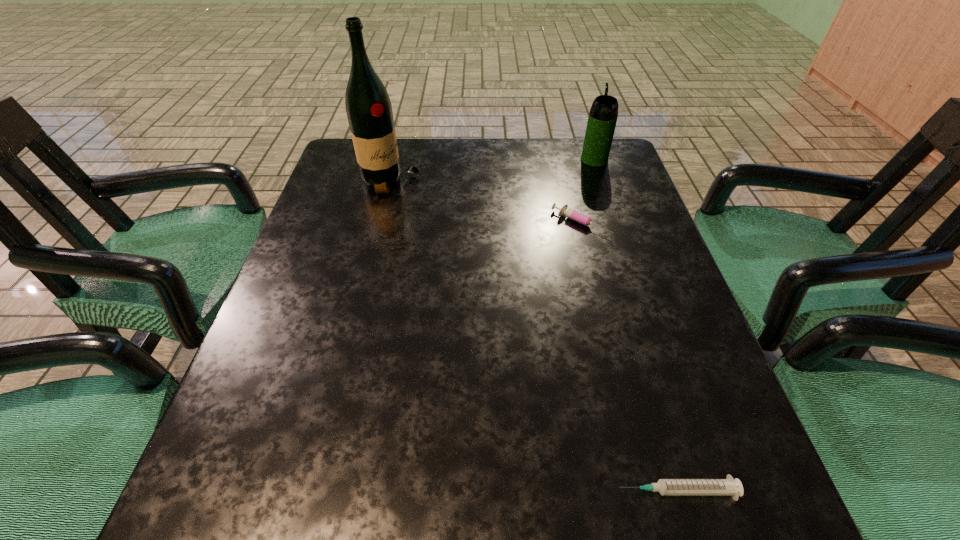
The height and width of the screenshot is (540, 960). I want to click on vacant space situated 0.340m at the needle end of the nearer syringe, so click(x=376, y=490).

Where is `wine bottle that is positioned at the far edge`? The height and width of the screenshot is (540, 960). wine bottle that is positioned at the far edge is located at coordinates (369, 111).

Find the location of a particular element. thermos bottle that is positioned at the far edge is located at coordinates (603, 114).

The height and width of the screenshot is (540, 960). In order to click on object that is positioned at the near edge in this screenshot , I will do `click(666, 487)`.

Locate an element on the screen. This screenshot has width=960, height=540. object at the left edge is located at coordinates (369, 111).

Identify the location of thermos bottle that is positioned at the right edge. The image size is (960, 540). (603, 114).

What are the coordinates of `object that is at the far left corner` in the screenshot? It's located at (369, 111).

Locate an element on the screen. The image size is (960, 540). object that is at the far right corner is located at coordinates (603, 114).

Find the location of a particular element. This screenshot has height=540, width=960. object that is at the near right corner is located at coordinates click(666, 487).

In the image, there is a desktop. Where is `vacant space at the far edge`? This screenshot has width=960, height=540. vacant space at the far edge is located at coordinates (463, 145).